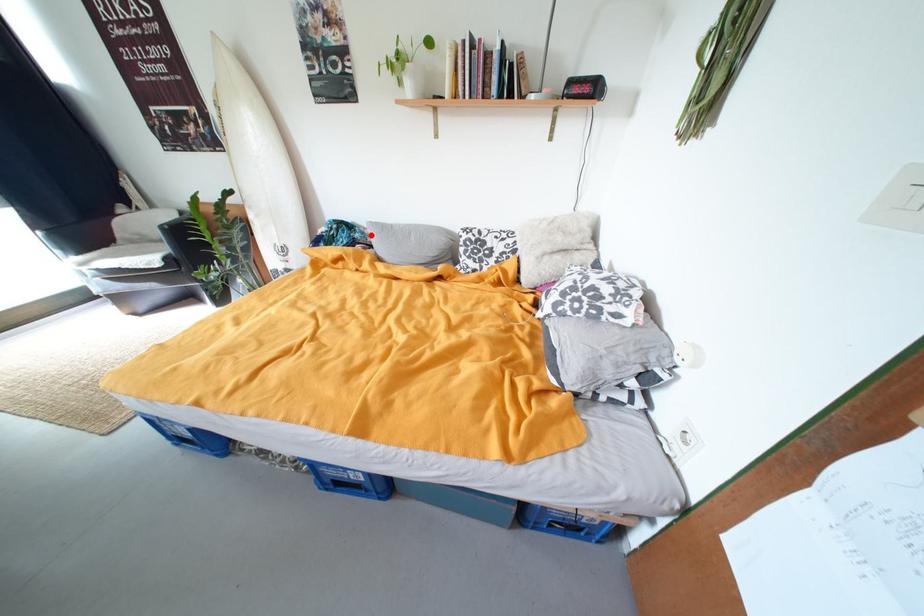
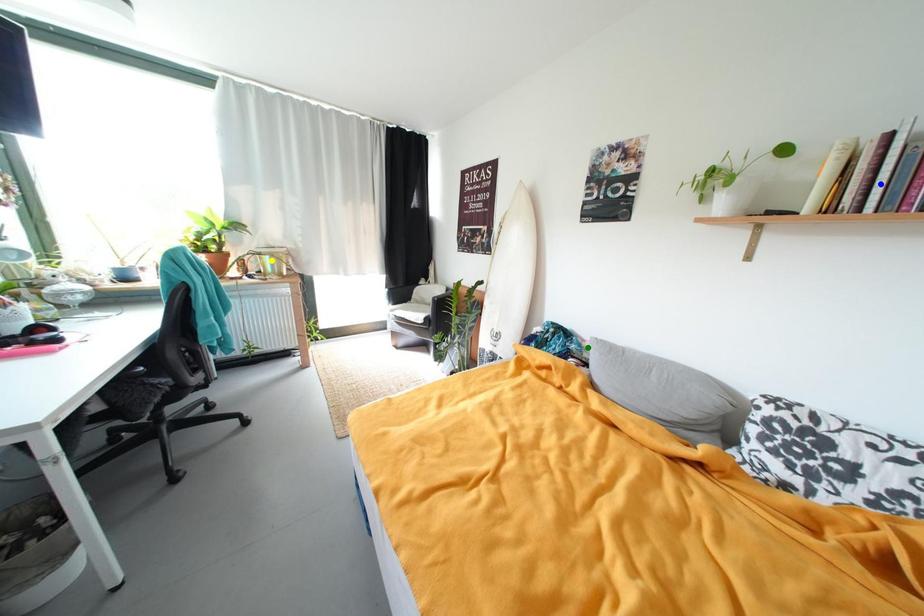
Question: I am providing you with two images of the same scene from different viewpoints. A red point is marked on the first image. You are given multiple points on the second image. Can you choose the point in image 2 that corresponds to the point in image 1?

Choices:
 (A) blue point
 (B) yellow point
 (C) green point

Answer: (C)